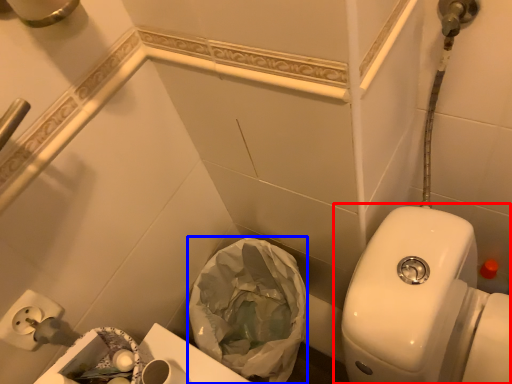
Question: Which point is further to the camera, toilet (highlighted by a red box) or garbage (highlighted by a blue box)?

Choices:
 (A) toilet
 (B) garbage

Answer: (B)